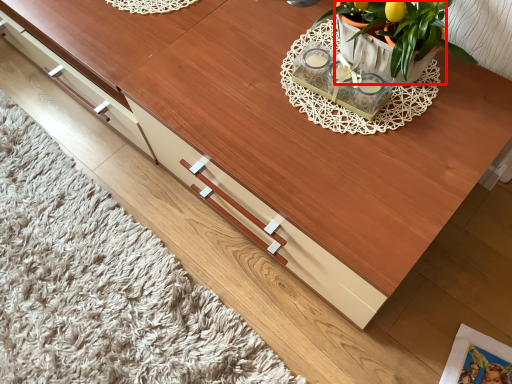
Question: From the image's perspective, considering the relative positions of flowerpot (annotated by the red box) and magazine in the image provided, where is flowerpot (annotated by the red box) located with respect to the staircase?

Choices:
 (A) above
 (B) below

Answer: (A)